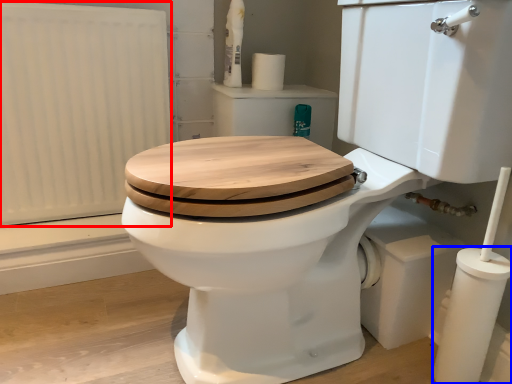
Question: Which object is further to the camera taking this photo, radiator (highlighted by a red box) or pillar (highlighted by a blue box)?

Choices:
 (A) radiator
 (B) pillar

Answer: (A)